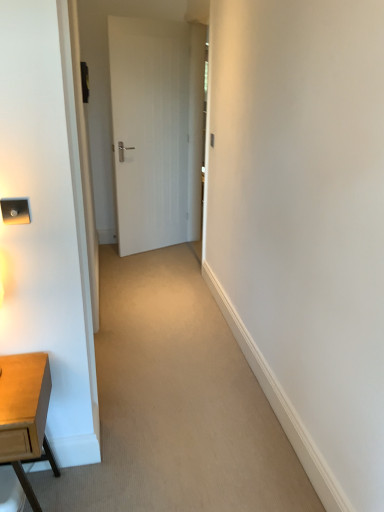
Question: Does light brown wooden desk at lower left have a lesser width compared to white wood door at center?

Choices:
 (A) no
 (B) yes

Answer: (A)

Question: Is light brown wooden desk at lower left at the left side of white wood door at center?

Choices:
 (A) yes
 (B) no

Answer: (A)

Question: Is light brown wooden desk at lower left taller than white wood door at center?

Choices:
 (A) yes
 (B) no

Answer: (B)

Question: Can you confirm if light brown wooden desk at lower left is wider than white wood door at center?

Choices:
 (A) yes
 (B) no

Answer: (A)

Question: Is light brown wooden desk at lower left closer to camera compared to white wood door at center?

Choices:
 (A) no
 (B) yes

Answer: (B)

Question: Are light brown wooden desk at lower left and white wood door at center located far from each other?

Choices:
 (A) yes
 (B) no

Answer: (A)

Question: Is white wood door at center shorter than light brown wooden desk at lower left?

Choices:
 (A) no
 (B) yes

Answer: (A)

Question: Would you say white wood door at center is a long distance from light brown wooden desk at lower left?

Choices:
 (A) no
 (B) yes

Answer: (B)

Question: Is white wood door at center bigger than light brown wooden desk at lower left?

Choices:
 (A) no
 (B) yes

Answer: (B)

Question: From the image's perspective, would you say white wood door at center is shown under light brown wooden desk at lower left?

Choices:
 (A) yes
 (B) no

Answer: (B)

Question: Is white wood door at center next to light brown wooden desk at lower left and touching it?

Choices:
 (A) no
 (B) yes

Answer: (A)

Question: Is white wood door at center to the right of light brown wooden desk at lower left from the viewer's perspective?

Choices:
 (A) no
 (B) yes

Answer: (B)

Question: Considering the positions of white wood door at center and light brown wooden desk at lower left in the image, is white wood door at center bigger or smaller than light brown wooden desk at lower left?

Choices:
 (A) big
 (B) small

Answer: (A)